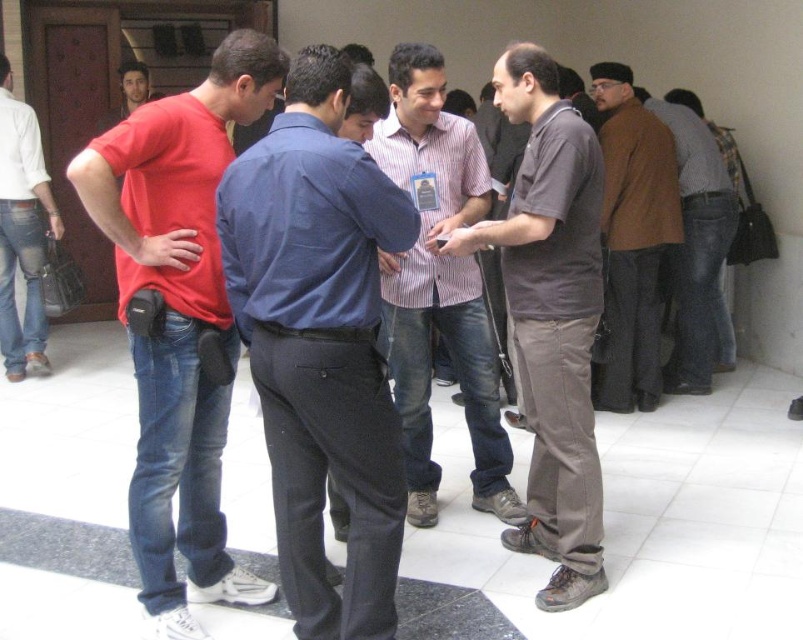
Who is positioned more to the right, brown leather jacket at right or jeans at left?

brown leather jacket at right

Is the position of brown leather jacket at right less distant than that of jeans at left?

Yes, it is.

Is point (687, 264) farther from viewer compared to point (35, 204)?

No.

Where is `brown leather jacket at right`? brown leather jacket at right is located at coordinates (698, 252).

Can you confirm if matte red t-shirt at left is positioned below striped cotton shirt at center?

Yes.

Between matte red t-shirt at left and striped cotton shirt at center, which one is positioned lower?

Positioned lower is matte red t-shirt at left.

Which is behind, point (117, 216) or point (473, 192)?

Positioned behind is point (473, 192).

At what (x,y) coordinates should I click in order to perform the action: click on matte red t-shirt at left. Please return your answer as a coordinate pair (x, y). Image resolution: width=803 pixels, height=640 pixels. Looking at the image, I should click on (178, 321).

Between striped cotton shirt at center and brown woolen sweater at right, which one appears on the left side from the viewer's perspective?

striped cotton shirt at center is more to the left.

Describe the element at coordinates (438, 285) in the screenshot. Image resolution: width=803 pixels, height=640 pixels. I see `striped cotton shirt at center` at that location.

Locate an element on the screen. striped cotton shirt at center is located at coordinates (438, 285).